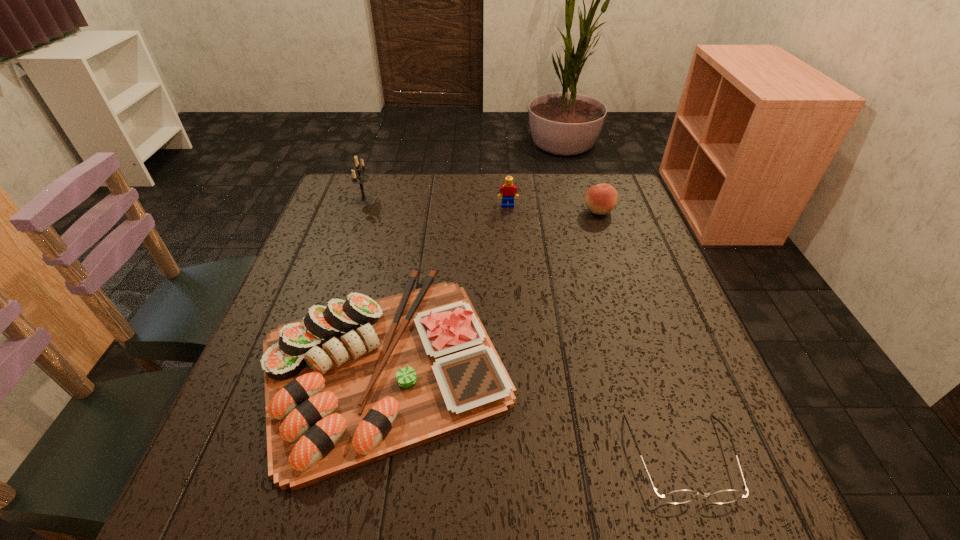
The height and width of the screenshot is (540, 960). Find the location of `candle holder`. candle holder is located at coordinates pos(358,178).

The image size is (960, 540). In order to click on the second tallest object in this screenshot , I will do `click(507, 191)`.

You are a GUI agent. You are given a task and a screenshot of the screen. Output one action in this format:
    pyautogui.click(x=<x>, y=<y>)
    Task: Click on the peach
    The image size is (960, 540).
    Given the screenshot: What is the action you would take?
    pyautogui.click(x=600, y=199)

At what (x,y) coordinates should I click in order to perform the action: click on platter. Please return your answer as a coordinate pair (x, y). The height and width of the screenshot is (540, 960). Looking at the image, I should click on (351, 383).

The width and height of the screenshot is (960, 540). I want to click on spectacles, so click(x=679, y=496).

The image size is (960, 540). Find the location of `vacant space located on the front of the tallest object`. vacant space located on the front of the tallest object is located at coordinates (349, 244).

I want to click on free space located on the front-facing side of the Lego, so click(x=513, y=269).

The height and width of the screenshot is (540, 960). I want to click on vacant region located on the left of the peach, so click(x=477, y=211).

You are a GUI agent. You are given a task and a screenshot of the screen. Output one action in this format:
    pyautogui.click(x=<x>, y=<y>)
    Task: Click on the blank space located 0.230m on the back of the platter
    
    Given the screenshot: What is the action you would take?
    pyautogui.click(x=413, y=221)

The width and height of the screenshot is (960, 540). I want to click on candle holder present at the far edge, so click(x=358, y=178).